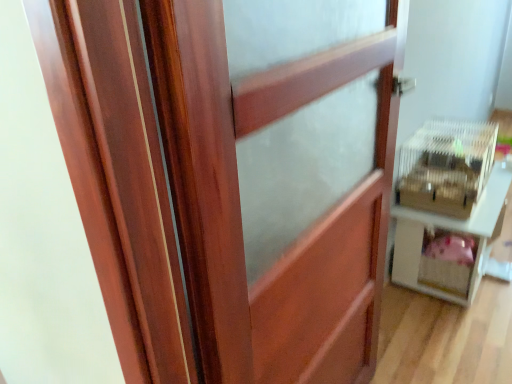
Question: Is wooden barn door at center behind white plastic cage at right?

Choices:
 (A) no
 (B) yes

Answer: (A)

Question: Is wooden barn door at center oriented away from white plastic cage at right?

Choices:
 (A) no
 (B) yes

Answer: (A)

Question: From the image's perspective, is wooden barn door at center beneath white plastic cage at right?

Choices:
 (A) yes
 (B) no

Answer: (A)

Question: From the image's perspective, is wooden barn door at center over white plastic cage at right?

Choices:
 (A) yes
 (B) no

Answer: (B)

Question: Does wooden barn door at center have a smaller size compared to white plastic cage at right?

Choices:
 (A) yes
 (B) no

Answer: (A)

Question: Is wooden barn door at center taller than white plastic cage at right?

Choices:
 (A) no
 (B) yes

Answer: (B)

Question: Considering the relative sizes of clear plastic crate at right and wooden barn door at center in the image provided, is clear plastic crate at right taller than wooden barn door at center?

Choices:
 (A) yes
 (B) no

Answer: (B)

Question: Does clear plastic crate at right have a greater width compared to wooden barn door at center?

Choices:
 (A) yes
 (B) no

Answer: (A)

Question: Are clear plastic crate at right and wooden barn door at center located far from each other?

Choices:
 (A) no
 (B) yes

Answer: (A)

Question: Does clear plastic crate at right have a lesser width compared to wooden barn door at center?

Choices:
 (A) yes
 (B) no

Answer: (B)

Question: Is clear plastic crate at right looking in the opposite direction of wooden barn door at center?

Choices:
 (A) no
 (B) yes

Answer: (A)

Question: Could wooden barn door at center be considered to be inside clear plastic crate at right?

Choices:
 (A) no
 (B) yes

Answer: (A)

Question: Considering the relative positions of white plastic cage at right and wooden barn door at center in the image provided, is white plastic cage at right to the left of wooden barn door at center from the viewer's perspective?

Choices:
 (A) yes
 (B) no

Answer: (B)